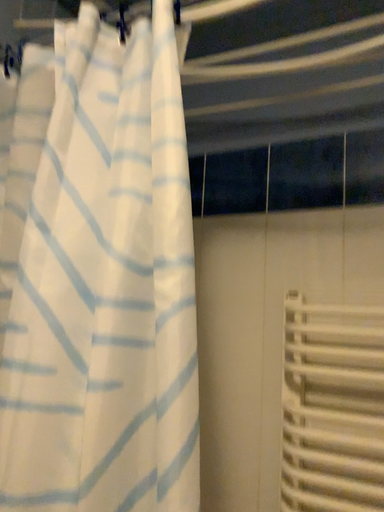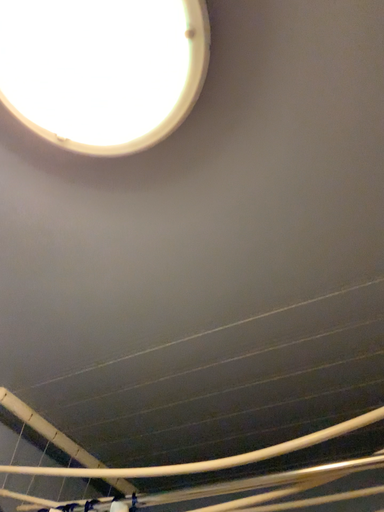
Question: How did the camera likely rotate when shooting the video?

Choices:
 (A) rotated downward
 (B) rotated upward

Answer: (B)